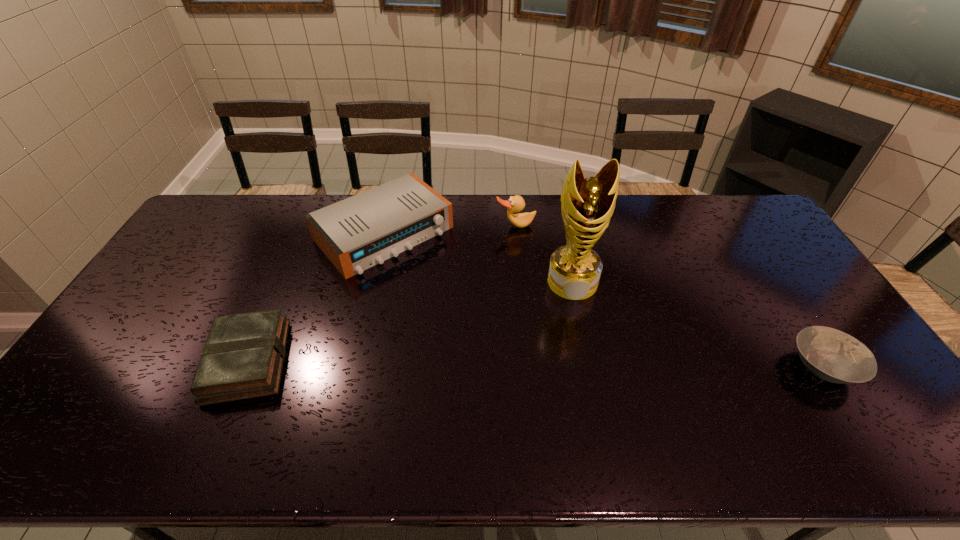
Where is `book positioned at the near edge`? The height and width of the screenshot is (540, 960). book positioned at the near edge is located at coordinates (243, 357).

Locate an element on the screen. bowl located at the near edge is located at coordinates (832, 355).

Where is `object that is at the right edge`? The width and height of the screenshot is (960, 540). object that is at the right edge is located at coordinates coord(832,355).

Find the location of a particular element. object at the near right corner is located at coordinates (832, 355).

In order to click on blank area at the far edge in this screenshot , I will do `click(704, 216)`.

Identify the location of free space at the near edge. (502, 393).

You are a GUI agent. You are given a task and a screenshot of the screen. Output one action in this format:
    pyautogui.click(x=<x>, y=<y>)
    Task: Click on the vacant space at the left edge
    The width and height of the screenshot is (960, 540).
    Given the screenshot: What is the action you would take?
    pyautogui.click(x=154, y=301)

Locate an element on the screen. Image resolution: width=960 pixels, height=540 pixels. vacant space at the right edge of the desktop is located at coordinates (780, 249).

In the image, there is a desktop. At what (x,y) coordinates should I click in order to perform the action: click on vacant space at the far left corner. Please return your answer as a coordinate pair (x, y). The image size is (960, 540). Looking at the image, I should click on click(188, 230).

Identify the location of vacant region at the far right corner of the desktop. This screenshot has width=960, height=540. (744, 221).